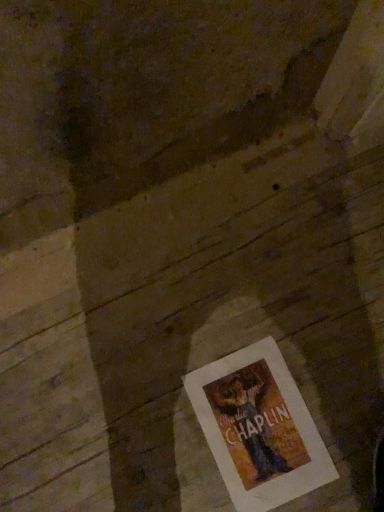
Find the location of a particular element. Image resolution: width=384 pixels, height=512 pixels. vacant area situated below matte paper poster at lower center (from a real-world perspective) is located at coordinates (257, 430).